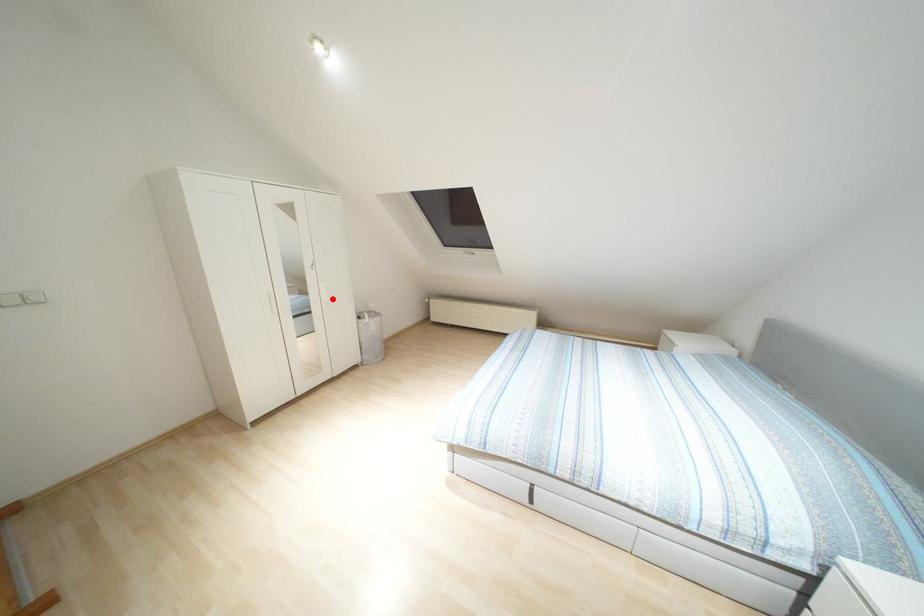
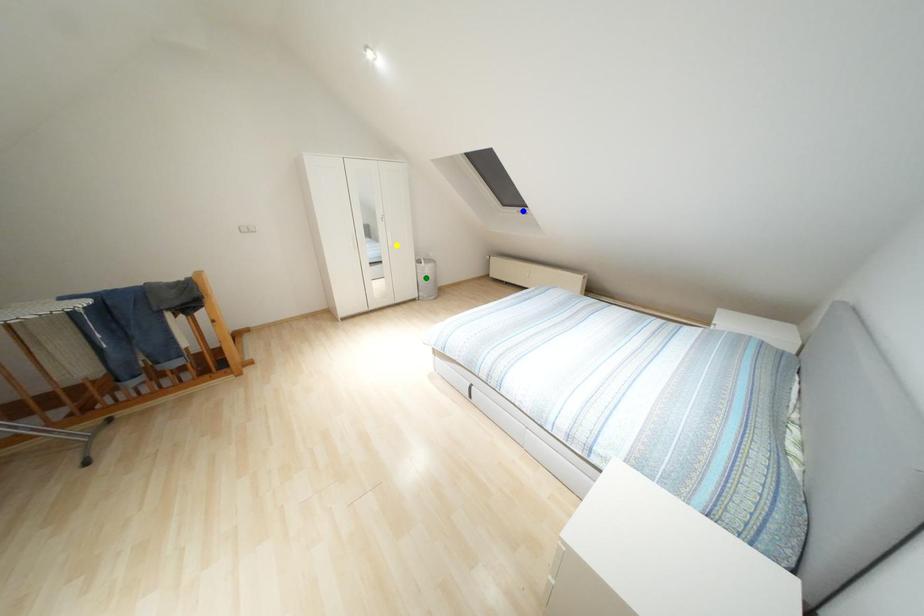
Question: I am providing you with two images of the same scene from different viewpoints. A red point is marked on the first image. You are given multiple points on the second image. Which point in image 2 represents the same 3d spot as the red point in image 1?

Choices:
 (A) blue point
 (B) yellow point
 (C) green point

Answer: (B)